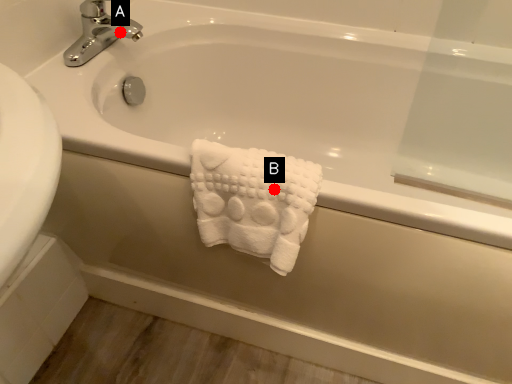
Question: Two points are circled on the image, labeled by A and B beside each circle. Which point appears closest to the camera in this image?

Choices:
 (A) A is closer
 (B) B is closer

Answer: (B)